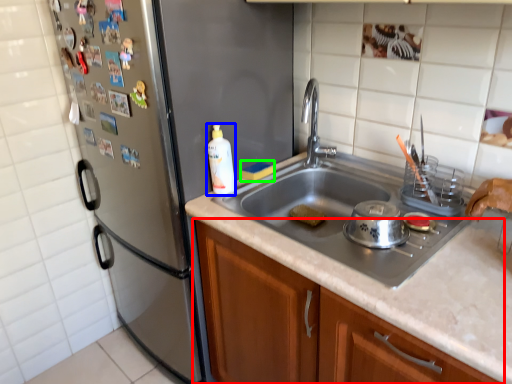
Question: Which object is the farthest from cabinetry (highlighted by a red box)? Choose among these: bottle (highlighted by a blue box) or food (highlighted by a green box).

Choices:
 (A) bottle
 (B) food

Answer: (B)